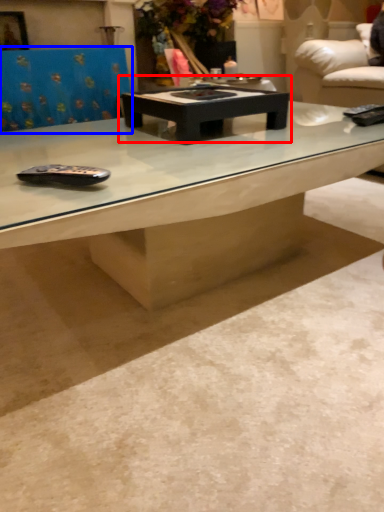
Question: Which of the following is the farthest to the observer, coffee table (highlighted by a red box) or swivel chair (highlighted by a blue box)?

Choices:
 (A) coffee table
 (B) swivel chair

Answer: (B)